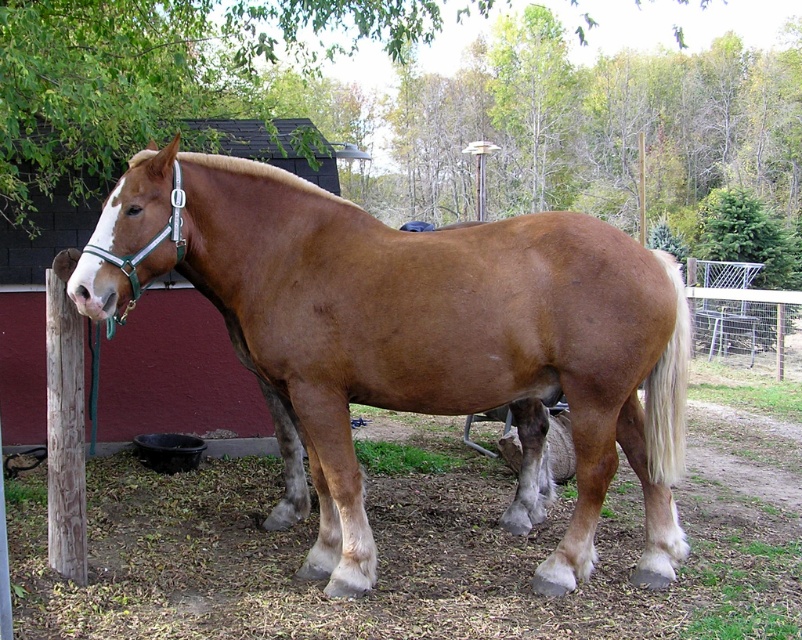
Question: Is white wire mesh fence at right closer to the viewer compared to white silky tail at right?

Choices:
 (A) yes
 (B) no

Answer: (B)

Question: Which object is farther from the camera taking this photo?

Choices:
 (A) brown glossy horse at center
 (B) white silky tail at right
 (C) white wire mesh fence at right

Answer: (C)

Question: Among these points, which one is nearest to the camera?

Choices:
 (A) (675, 323)
 (B) (721, 269)

Answer: (A)

Question: Which point appears farthest from the camera in this image?

Choices:
 (A) (329, 216)
 (B) (667, 476)
 (C) (695, 288)

Answer: (C)

Question: Is white wire mesh fence at right wider than white silky tail at right?

Choices:
 (A) no
 (B) yes

Answer: (B)

Question: Can you confirm if white wire mesh fence at right is positioned below white silky tail at right?

Choices:
 (A) no
 (B) yes

Answer: (A)